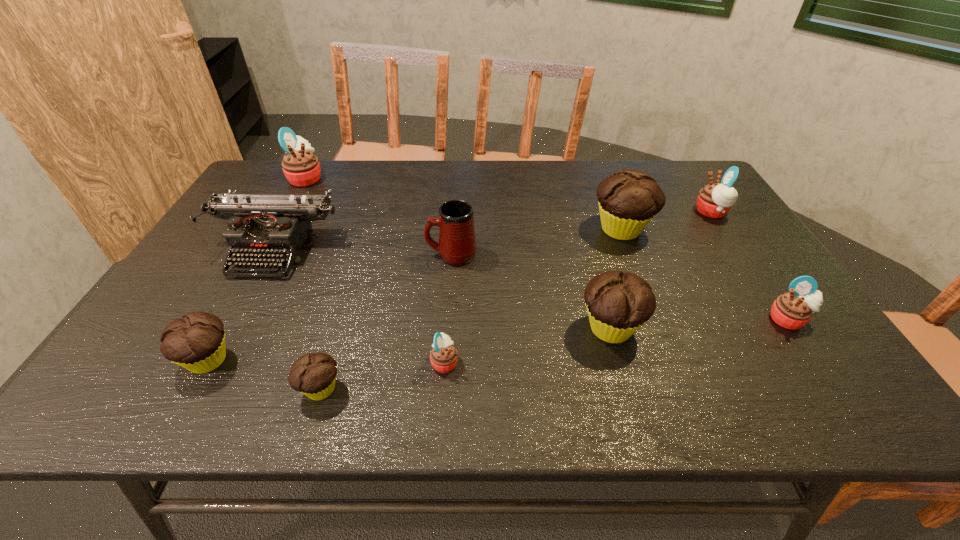
Identify the location of object at the near left corner. The width and height of the screenshot is (960, 540). (196, 342).

In the image, there is a desktop. Where is `blank space at the far edge`? blank space at the far edge is located at coordinates (408, 190).

Identify the location of vacant space at the left edge. This screenshot has height=540, width=960. (228, 304).

The width and height of the screenshot is (960, 540). Find the location of `free space at the right edge of the desktop`. free space at the right edge of the desktop is located at coordinates (724, 266).

In the image, there is a desktop. Identify the location of free space at the far left corner. (277, 177).

At what (x,y) coordinates should I click in order to perform the action: click on vacant point at the near left corner. Please return your answer as a coordinate pair (x, y). Looking at the image, I should click on (103, 388).

The height and width of the screenshot is (540, 960). In the image, there is a desktop. In order to click on vacant space at the far right corner in this screenshot , I will do `click(669, 177)`.

The width and height of the screenshot is (960, 540). I want to click on free space between the farthest chocolate muffin and the second smallest pink muffin, so click(x=705, y=274).

Identify the location of vacant space in between the second biggest pink muffin and the second chocolate muffin from left to right. This screenshot has height=540, width=960. (516, 301).

Where is `vacant region between the third smallest chocolate muffin and the third farthest pink muffin`? The image size is (960, 540). vacant region between the third smallest chocolate muffin and the third farthest pink muffin is located at coordinates (700, 323).